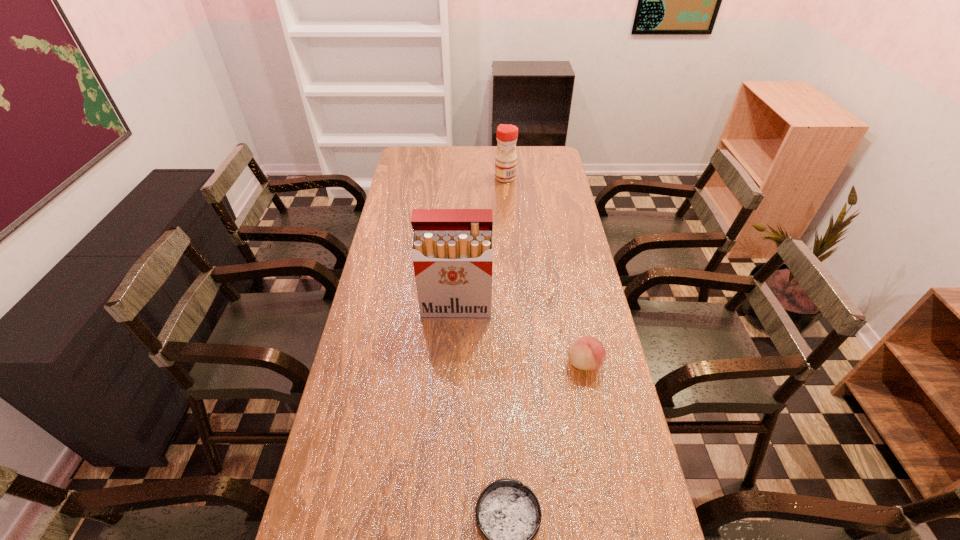
This screenshot has height=540, width=960. Find the location of `free point that satisfies the following two spatial constraints: 1. on the front side of the second shortest object; 2. on the left side of the condiment`. free point that satisfies the following two spatial constraints: 1. on the front side of the second shortest object; 2. on the left side of the condiment is located at coordinates (519, 363).

Where is `vacant space that satisfies the following two spatial constraints: 1. with the lid open on the peach; 2. on the right side of the cigarette case`? This screenshot has width=960, height=540. vacant space that satisfies the following two spatial constraints: 1. with the lid open on the peach; 2. on the right side of the cigarette case is located at coordinates (454, 363).